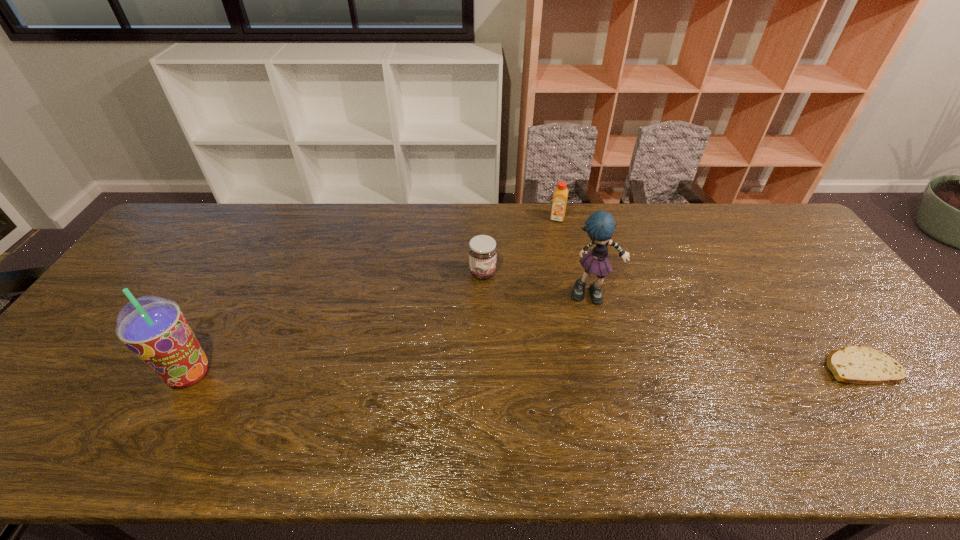
Image resolution: width=960 pixels, height=540 pixels. Find the location of `free space on the desktop that is between the smoothie and the shortest object and is positioned on the front label of the jam`. free space on the desktop that is between the smoothie and the shortest object and is positioned on the front label of the jam is located at coordinates (625, 369).

This screenshot has height=540, width=960. I want to click on vacant space on the desktop that is between the smoothie and the shortest object and is positioned on the front and back of the orange juice, so click(528, 370).

Identify the location of free space on the desktop that is between the leftmost object and the shortest object and is positioned on the front-facing side of the third nearest object. (608, 369).